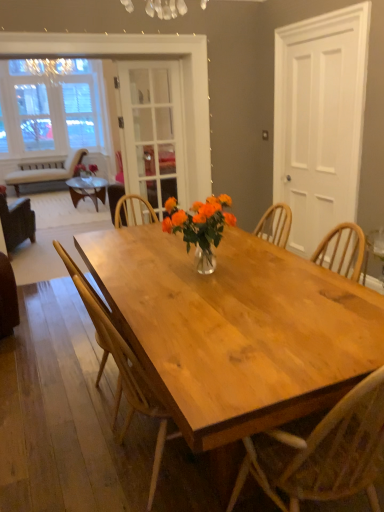
Question: Based on their positions, is clear glass screen door at center, acting as the 2th screen door starting from the right, located to the left or right of brown leather chair at left, which ranks as the third chair in front-to-back order?

Choices:
 (A) right
 (B) left

Answer: (A)

Question: From a real-world perspective, is clear glass screen door at center, acting as the 2th screen door starting from the right, positioned above or below brown leather chair at left, which ranks as the third chair in front-to-back order?

Choices:
 (A) above
 (B) below

Answer: (A)

Question: Estimate the real-world distances between objects in this image. Which object is closer to the natural wood chair at center, the 2th chair from the back?

Choices:
 (A) brown leather chair at left, which ranks as the third chair in front-to-back order
 (B) wooden chair at center, which appears as the 1th chair when viewed from the right
 (C) translucent glass vase at center
 (D) velvet green sofa at left
 (E) clear glass screen door at center, acting as the 2th screen door starting from the right

Answer: (B)

Question: Based on their relative distances, which object is farther from the natural wood chair at center, placed as the second chair when sorted from front to back?

Choices:
 (A) clear glass screen door at center, the 1th screen door viewed from the left
 (B) velvet green sofa at left
 (C) white matte door at right, acting as the second screen door starting from the left
 (D) translucent glass vase at center
 (E) brown leather chair at left, the 3th chair when ordered from right to left

Answer: (B)